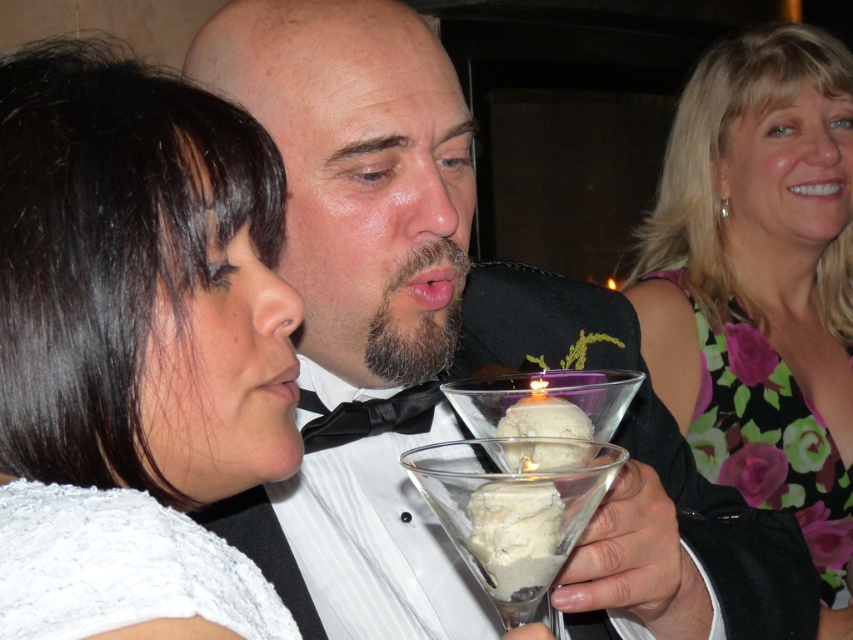
You are organizing a photo shoot and need to determine the spatial arrangement of the outfits. Given the white lace at left and the floral fabric dress at upper right, which one is narrower in width?

The white lace at left has a lesser width compared to the floral fabric dress at upper right, so the white lace at left is narrower.